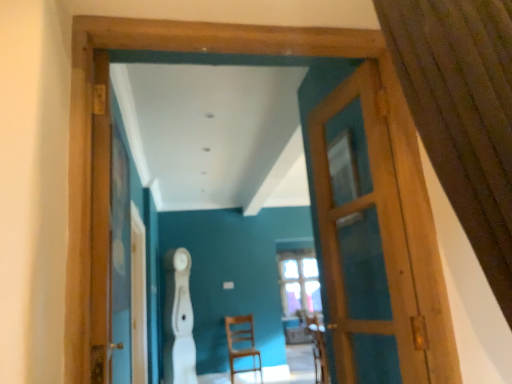
Question: From the image's perspective, is wooden armchair at center below wooden door at center?

Choices:
 (A) no
 (B) yes

Answer: (B)

Question: Would you say wooden door at center is part of wooden armchair at center's contents?

Choices:
 (A) no
 (B) yes

Answer: (A)

Question: Can you confirm if wooden armchair at center is positioned to the right of wooden door at center?

Choices:
 (A) no
 (B) yes

Answer: (B)

Question: Does wooden armchair at center come behind wooden door at center?

Choices:
 (A) no
 (B) yes

Answer: (B)

Question: Is wooden armchair at center not near wooden door at center?

Choices:
 (A) no
 (B) yes

Answer: (B)

Question: Is wooden door at center bigger or smaller than brown textured curtain at upper right?

Choices:
 (A) big
 (B) small

Answer: (B)

Question: Considering their positions, is wooden door at center located in front of or behind brown textured curtain at upper right?

Choices:
 (A) behind
 (B) front

Answer: (A)

Question: From a real-world perspective, relative to brown textured curtain at upper right, is wooden door at center vertically above or below?

Choices:
 (A) below
 (B) above

Answer: (A)

Question: Looking at their shapes, would you say wooden door at center is wider or thinner than brown textured curtain at upper right?

Choices:
 (A) wide
 (B) thin

Answer: (B)

Question: Considering the positions of wooden chair at center and wooden screen door at left in the image, is wooden chair at center wider or thinner than wooden screen door at left?

Choices:
 (A) wide
 (B) thin

Answer: (A)

Question: From the image's perspective, is wooden chair at center positioned above or below wooden screen door at left?

Choices:
 (A) above
 (B) below

Answer: (B)

Question: Based on their positions, is wooden chair at center located to the left or right of wooden screen door at left?

Choices:
 (A) right
 (B) left

Answer: (A)

Question: Does point coord(233,332) appear closer or farther from the camera than point coord(97,175)?

Choices:
 (A) closer
 (B) farther

Answer: (B)

Question: Is wooden door at center taller or shorter than wooden chair at center?

Choices:
 (A) tall
 (B) short

Answer: (A)

Question: Considering the relative positions of wooden door at center and wooden chair at center in the image provided, is wooden door at center to the left or to the right of wooden chair at center?

Choices:
 (A) left
 (B) right

Answer: (B)